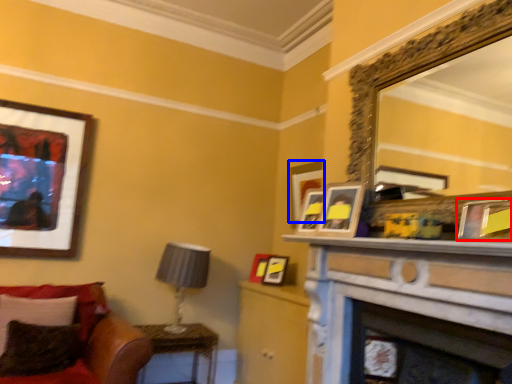
Question: Which object appears closest to the camera in this image, picture frame (highlighted by a red box) or picture frame (highlighted by a blue box)?

Choices:
 (A) picture frame
 (B) picture frame

Answer: (A)